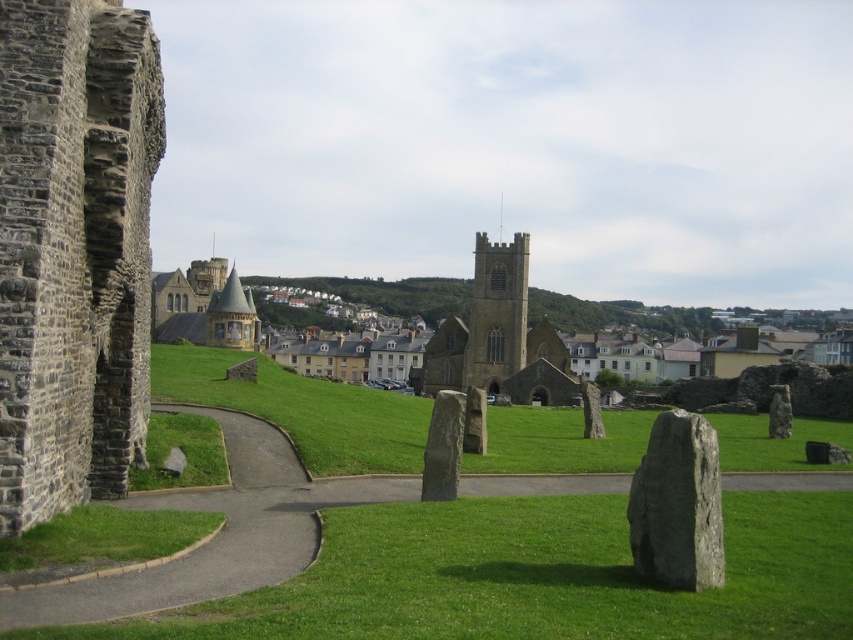
You are standing at the entrance of the pathway in the grassy area. You want to walk directly towards the dark brown stone tower at center. Which direction should you head?

The dark brown stone tower at center is located at point (497, 312), so you should head towards the center of the scene where the tower is positioned.

You are a visitor at this historic site and want to take a photo of the gray stone church at left and the smooth gray stone at center. Which object will appear larger in your photo?

The gray stone church at left appears larger in the photo because it is closer to the viewer than the smooth gray stone at center.